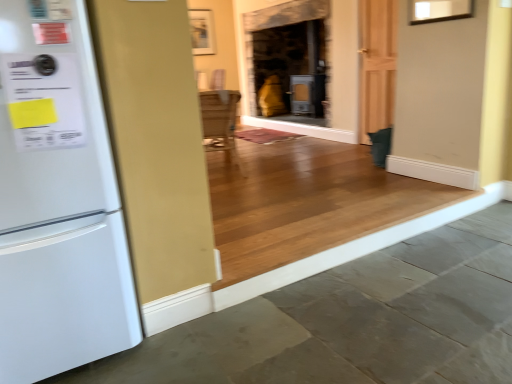
Locate an element on the screen. The height and width of the screenshot is (384, 512). gray concrete at lower left is located at coordinates (352, 322).

Locate an element on the screen. This screenshot has width=512, height=384. wooden frame at upper center is located at coordinates (202, 31).

Is white matte refrigerator at left next to gray concrete at lower left and touching it?

No, white matte refrigerator at left is not next to gray concrete at lower left.

Locate an element on the screen. The image size is (512, 384). refrigerator located above the gray concrete at lower left (from the image's perspective) is located at coordinates (57, 200).

From a real-world perspective, is white matte refrigerator at left over gray concrete at lower left?

Correct, in the physical world, white matte refrigerator at left is higher than gray concrete at lower left.

Would you consider wooden frame at upper center to be distant from gray concrete at lower left?

That's right, there is a large distance between wooden frame at upper center and gray concrete at lower left.

Locate an element on the screen. picture frame that appears above the gray concrete at lower left (from a real-world perspective) is located at coordinates (202, 31).

Is wooden frame at upper center completely or partially outside of gray concrete at lower left?

Indeed, wooden frame at upper center is completely outside gray concrete at lower left.

How many degrees apart are the facing directions of wooden frame at upper center and gray concrete at lower left?

There is a 178-degree angle between the facing directions of wooden frame at upper center and gray concrete at lower left.

Considering the relative positions of white matte refrigerator at left and wooden frame at upper center in the image provided, is white matte refrigerator at left to the right of wooden frame at upper center from the viewer's perspective?

Yes, white matte refrigerator at left is to the right of wooden frame at upper center.

From a real-world perspective, which object stands above the other?

wooden frame at upper center.

From the image's perspective, which is below, white matte refrigerator at left or wooden frame at upper center?

white matte refrigerator at left.

Who is shorter, white matte refrigerator at left or wooden frame at upper center?

wooden frame at upper center is shorter.

From the image's perspective, which one is positioned lower, gray concrete at lower left or wooden frame at upper center?

gray concrete at lower left appears lower in the image.

Is gray concrete at lower left not near wooden frame at upper center?

Yes, gray concrete at lower left and wooden frame at upper center are quite far apart.

From the picture: Is gray concrete at lower left to the left of wooden frame at upper center from the viewer's perspective?

In fact, gray concrete at lower left is to the right of wooden frame at upper center.

From the image's perspective, is wooden frame at upper center positioned above or below white matte refrigerator at left?

Based on their image positions, wooden frame at upper center is located above white matte refrigerator at left.

Considering the points (213, 46) and (69, 0), which point is behind, point (213, 46) or point (69, 0)?

The point (213, 46) is more distant.

Based on the photo, could you tell me if wooden frame at upper center is facing white matte refrigerator at left?

No.

From a real-world perspective, who is located lower, wooden frame at upper center or white matte refrigerator at left?

white matte refrigerator at left, from a real-world perspective.

Is point (165, 370) less distant than point (5, 220)?

No, (165, 370) is further to viewer.

Who is shorter, gray concrete at lower left or white matte refrigerator at left?

gray concrete at lower left.

Which of these two, gray concrete at lower left or white matte refrigerator at left, is smaller?

Smaller between the two is gray concrete at lower left.

Image resolution: width=512 pixels, height=384 pixels. What are the coordinates of `concrete located below the white matte refrigerator at left (from the image's perspective)` in the screenshot? It's located at (352, 322).

The image size is (512, 384). In the image, there is a white matte refrigerator at left. Identify the location of concrete below it (from a real-world perspective). (352, 322).

Where is `concrete lying in front of the wooden frame at upper center`? This screenshot has height=384, width=512. concrete lying in front of the wooden frame at upper center is located at coordinates (352, 322).

Estimate the real-world distances between objects in this image. Which object is closer to wooden frame at upper center, white matte refrigerator at left or gray concrete at lower left?

The object closer to wooden frame at upper center is white matte refrigerator at left.

Based on the photo, based on their spatial positions, is white matte refrigerator at left or wooden frame at upper center closer to gray concrete at lower left?

The object closer to gray concrete at lower left is white matte refrigerator at left.

Which object lies nearer to the anchor point white matte refrigerator at left, wooden frame at upper center or gray concrete at lower left?

Based on the image, gray concrete at lower left appears to be nearer to white matte refrigerator at left.

Based on the photo, which object lies nearer to the anchor point wooden frame at upper center, gray concrete at lower left or white matte refrigerator at left?

The object closer to wooden frame at upper center is white matte refrigerator at left.

Looking at this image, based on their spatial positions, is gray concrete at lower left or wooden frame at upper center further from white matte refrigerator at left?

wooden frame at upper center is positioned further to the anchor white matte refrigerator at left.

Considering their positions, is wooden frame at upper center positioned closer to gray concrete at lower left than white matte refrigerator at left?

The object closer to gray concrete at lower left is white matte refrigerator at left.

Where is `refrigerator positioned between gray concrete at lower left and wooden frame at upper center from near to far`? The height and width of the screenshot is (384, 512). refrigerator positioned between gray concrete at lower left and wooden frame at upper center from near to far is located at coordinates (57, 200).